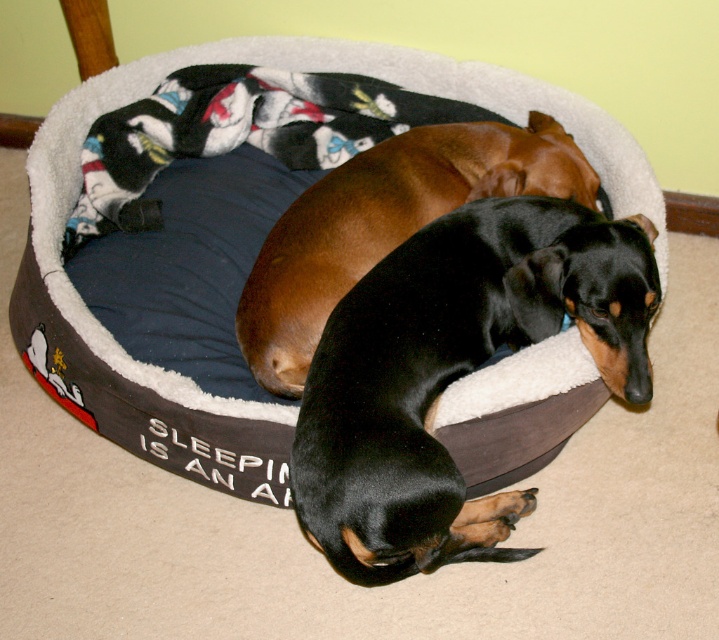
Question: In this image, where is dark gray plush dog bed at center located relative to brown smooth dog at center?

Choices:
 (A) left
 (B) right

Answer: (A)

Question: From the image, what is the correct spatial relationship of black smooth dog at center in relation to brown smooth dog at center?

Choices:
 (A) left
 (B) right

Answer: (B)

Question: Which point is farther from the camera taking this photo?

Choices:
 (A) (50, 390)
 (B) (408, 317)

Answer: (A)

Question: Which object is positioned closest to the brown smooth dog at center?

Choices:
 (A) black smooth dog at center
 (B) dark gray plush dog bed at center

Answer: (B)

Question: Which point is closer to the camera taking this photo?

Choices:
 (A) (490, 148)
 (B) (334, 483)
 (C) (262, 193)

Answer: (B)

Question: Can you confirm if black smooth dog at center is smaller than brown smooth dog at center?

Choices:
 (A) yes
 (B) no

Answer: (A)